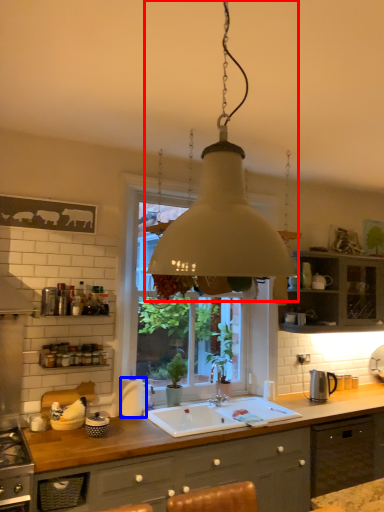
Question: Which of the following is the closest to the observer, lamp (highlighted by a red box) or appliance (highlighted by a blue box)?

Choices:
 (A) lamp
 (B) appliance

Answer: (A)